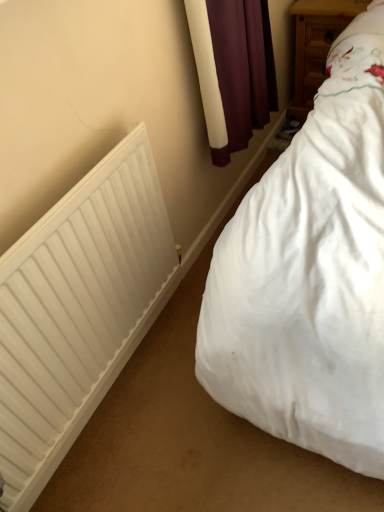
Question: Is white matte radiator at left in front of or behind white wood nightstand at upper right in the image?

Choices:
 (A) front
 (B) behind

Answer: (A)

Question: From the image's perspective, relative to white wood nightstand at upper right, is white matte radiator at left above or below?

Choices:
 (A) above
 (B) below

Answer: (B)

Question: In terms of width, does white matte radiator at left look wider or thinner when compared to white wood nightstand at upper right?

Choices:
 (A) thin
 (B) wide

Answer: (A)

Question: Considering their positions, is white wood nightstand at upper right located in front of or behind white matte radiator at left?

Choices:
 (A) behind
 (B) front

Answer: (A)

Question: From the image's perspective, relative to white matte radiator at left, is white wood nightstand at upper right above or below?

Choices:
 (A) below
 (B) above

Answer: (B)

Question: Is point (296, 109) closer or farther from the camera than point (34, 485)?

Choices:
 (A) farther
 (B) closer

Answer: (A)

Question: Considering the positions of white wood nightstand at upper right and white matte radiator at left in the image, is white wood nightstand at upper right wider or thinner than white matte radiator at left?

Choices:
 (A) thin
 (B) wide

Answer: (B)